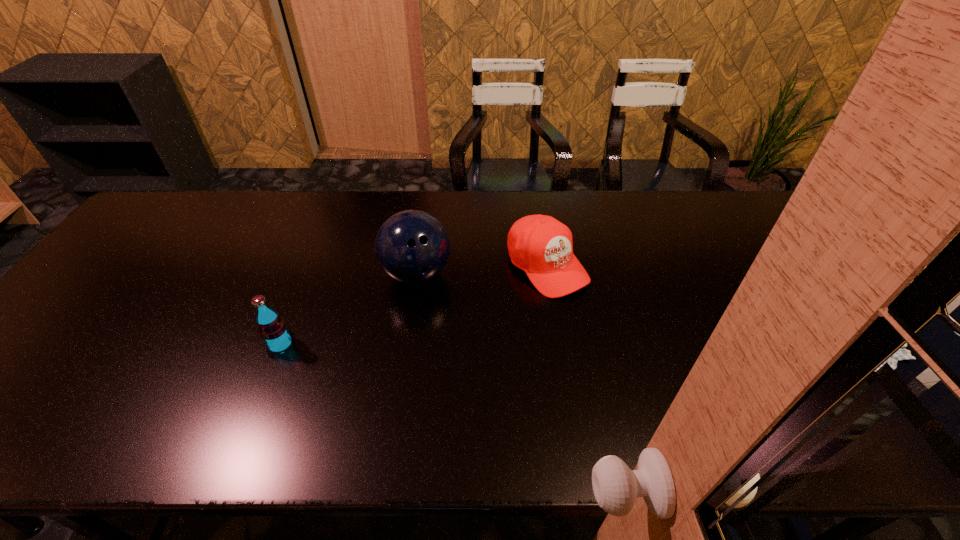
At what (x,y) coordinates should I click in order to perform the action: click on vacant space located 0.170m on the front panel of the baseball cap. Please return your answer as a coordinate pair (x, y). Image resolution: width=960 pixels, height=540 pixels. Looking at the image, I should click on (616, 339).

In order to click on blank area located on the front panel of the baseball cap in this screenshot , I will do `click(589, 312)`.

The height and width of the screenshot is (540, 960). What are the coordinates of `free point located on the front panel of the baseball cap` in the screenshot? It's located at (608, 330).

In the image, there is a desktop. In order to click on free space at the far edge in this screenshot , I will do `click(412, 195)`.

At what (x,y) coordinates should I click in order to perform the action: click on vacant space at the near edge of the desktop. Please return your answer as a coordinate pair (x, y). Looking at the image, I should click on tap(94, 376).

Locate an element on the screen. This screenshot has width=960, height=540. free spot at the left edge of the desktop is located at coordinates (96, 332).

At what (x,y) coordinates should I click in order to perform the action: click on vacant space at the right edge. Please return your answer as a coordinate pair (x, y). Image resolution: width=960 pixels, height=540 pixels. Looking at the image, I should click on (836, 288).

Where is `vacant area that lies between the nearest object and the rightmost object`? This screenshot has width=960, height=540. vacant area that lies between the nearest object and the rightmost object is located at coordinates (414, 305).

Locate an element on the screen. free space between the bowling ball and the soda is located at coordinates (348, 309).

The height and width of the screenshot is (540, 960). Find the location of `vacant region between the tallest object and the shortest object`. vacant region between the tallest object and the shortest object is located at coordinates (482, 270).